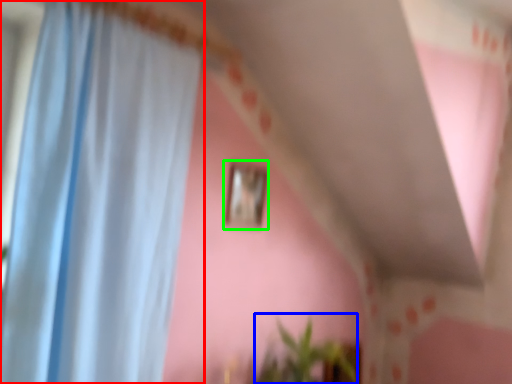
Question: Considering the real-world distances, which object is farthest from curtain (highlighted by a red box)? plant (highlighted by a blue box) or picture frame (highlighted by a green box)?

Choices:
 (A) plant
 (B) picture frame

Answer: (A)